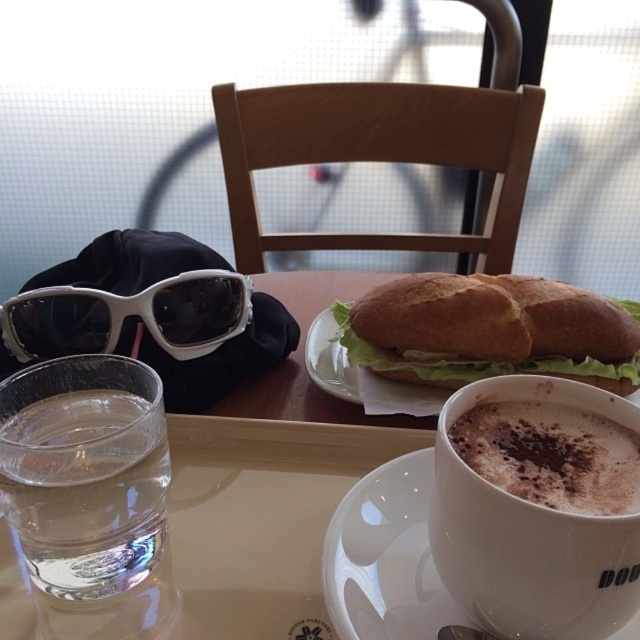
You are a barista preparing a cup of coffee for a customer. The customer wants to place their coffee cup on the tray. Which saucer should you use to place the cup on, the white ceramic saucer at center or the white glossy saucer at center?

The white glossy saucer at center should be used to place the cup on because the white ceramic saucer at center is positioned under it, meaning the glossy one is on top and available for use.

Based on the photo, you are a customer at the cozy cafe and want to reach for the white glossy saucer at center without knocking over the clear glass water at lower left. Which direction should you move your hand from the saucer to avoid the glass?

The clear glass water at lower left is positioned on the left side of the white glossy saucer at center. To avoid knocking over the glass, you should move your hand from the saucer towards the right direction away from the glass.

You are a customer at the cozy cafe and want to place your phone on the tray. The phone is 15 cm long. The tray has a clear glass water at lower left. Where should you place your phone to avoid spilling the water?

Result: Place the phone on the right side of the tray away from the clear glass water at lower left to avoid spilling the water.